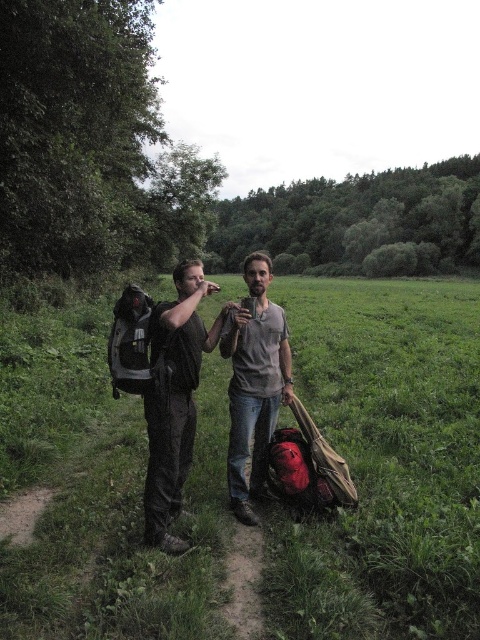
Between matte black backpack at center and matte gray shirt at center, which one has more height?

Standing taller between the two is matte gray shirt at center.

Who is lower down, matte black backpack at center or matte gray shirt at center?

Positioned lower is matte black backpack at center.

Does point (177, 490) come behind point (236, 348)?

No, it is in front of (236, 348).

Where is `matte black backpack at center`? This screenshot has width=480, height=640. matte black backpack at center is located at coordinates (175, 400).

Which is behind, point (59, 481) or point (261, 444)?

The point (59, 481) is behind.

The height and width of the screenshot is (640, 480). Find the location of `matte black backpack at left`. matte black backpack at left is located at coordinates (384, 461).

Does matte black backpack at left have a greater width compared to matte black backpack at center?

Yes, matte black backpack at left is wider than matte black backpack at center.

Which is in front, point (120, 400) or point (158, 317)?

Point (158, 317) is more forward.

Who is more forward, [225,516] or [148,416]?

Positioned in front is point [148,416].

You are a GUI agent. You are given a task and a screenshot of the screen. Output one action in this format:
    pyautogui.click(x=<x>, y=<y>)
    Task: Click on the matte black backpack at left
    This screenshot has width=480, height=640.
    Given the screenshot: What is the action you would take?
    pyautogui.click(x=384, y=461)